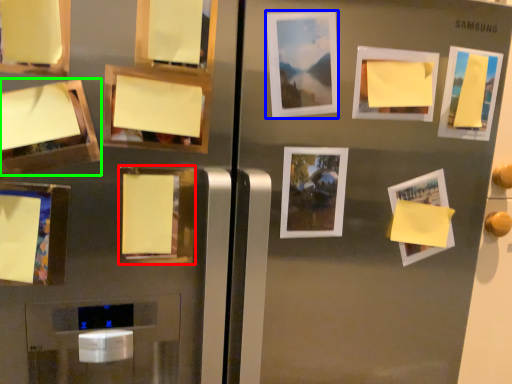
Question: Considering the real-world distances, which object is farthest from picture frame (highlighted by a red box)? picture frame (highlighted by a blue box) or picture frame (highlighted by a green box)?

Choices:
 (A) picture frame
 (B) picture frame

Answer: (A)